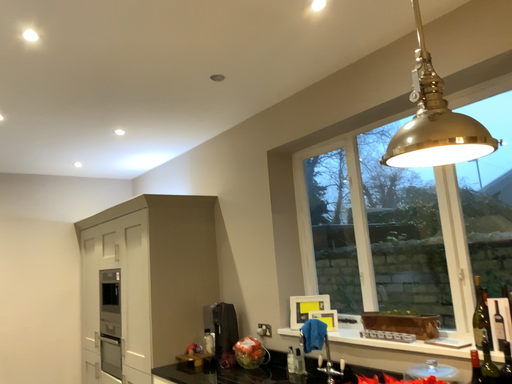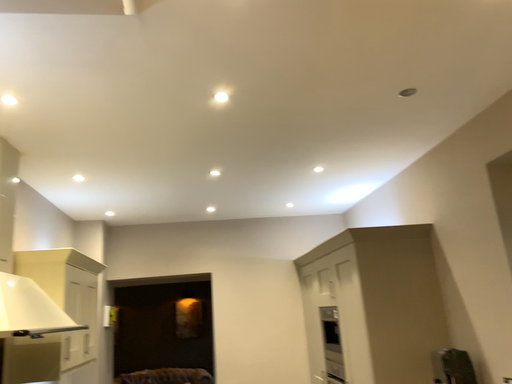
Question: Which way did the camera rotate in the video?

Choices:
 (A) rotated right
 (B) rotated left

Answer: (B)